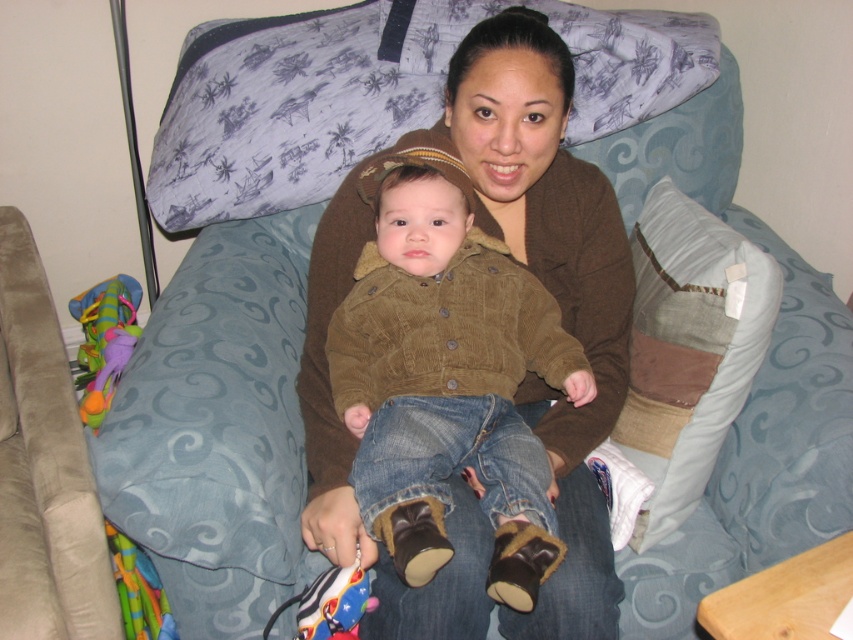
Which is behind, point (390, 337) or point (720, 317)?

Positioned behind is point (720, 317).

Measure the distance between brown corduroy jacket at center and camera.

brown corduroy jacket at center is 34.44 inches from camera.

Describe the element at coordinates (448, 380) in the screenshot. I see `brown corduroy jacket at center` at that location.

Find the location of a particular element. The height and width of the screenshot is (640, 853). brown corduroy jacket at center is located at coordinates (448, 380).